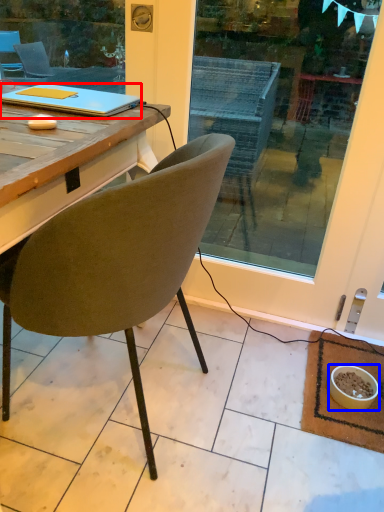
Question: Which of the following is the closest to the observer, laptop (highlighted by a red box) or bowl (highlighted by a blue box)?

Choices:
 (A) laptop
 (B) bowl

Answer: (A)